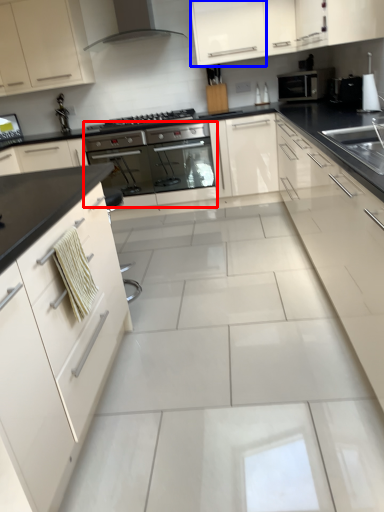
Question: Which of the following is the farthest to the observer, oven (highlighted by a red box) or cabinetry (highlighted by a blue box)?

Choices:
 (A) oven
 (B) cabinetry

Answer: (A)